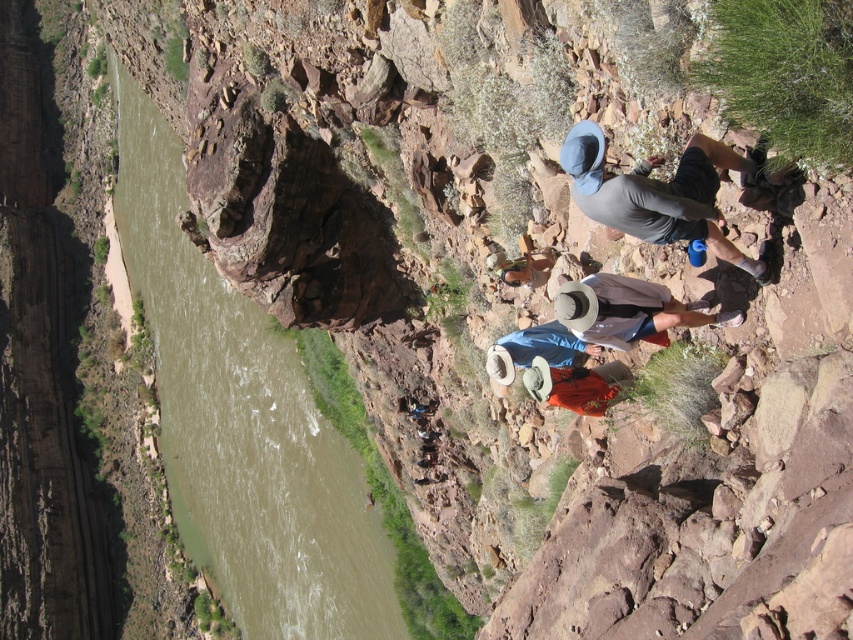
Is brown rock at center above gray fabric hat at upper right?

No, brown rock at center is not above gray fabric hat at upper right.

Measure the distance between brown rock at center and gray fabric hat at upper right.

brown rock at center and gray fabric hat at upper right are 47.96 meters apart from each other.

Locate an element on the screen. The height and width of the screenshot is (640, 853). brown rock at center is located at coordinates click(242, 422).